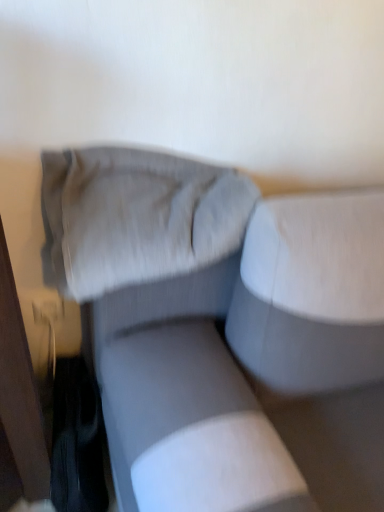
Locate an element on the screen. This screenshot has height=512, width=384. textured gray couch at center is located at coordinates (203, 316).

Describe the element at coordinates (203, 316) in the screenshot. This screenshot has width=384, height=512. I see `textured gray couch at center` at that location.

Describe the element at coordinates (136, 217) in the screenshot. I see `suede-like gray pillow at upper center` at that location.

Image resolution: width=384 pixels, height=512 pixels. Find the location of `suede-like gray pillow at upper center`. suede-like gray pillow at upper center is located at coordinates (136, 217).

In order to face suede-like gray pillow at upper center, should I rotate leftwards or rightwards?

Turn left by 5.592 degrees to look at suede-like gray pillow at upper center.

This screenshot has width=384, height=512. In order to click on textured gray couch at center in this screenshot , I will do `click(203, 316)`.

Based on their positions, is textured gray couch at center located to the left or right of suede-like gray pillow at upper center?

textured gray couch at center is to the right of suede-like gray pillow at upper center.

Is textured gray couch at center in front of or behind suede-like gray pillow at upper center in the image?

textured gray couch at center is positioned closer to the viewer than suede-like gray pillow at upper center.

Which is behind, point (142, 273) or point (75, 238)?

The point (75, 238) is more distant.

From the image's perspective, is textured gray couch at center above or below suede-like gray pillow at upper center?

Based on their image positions, textured gray couch at center is located beneath suede-like gray pillow at upper center.

From a real-world perspective, is textured gray couch at center beneath suede-like gray pillow at upper center?

Yes.

Which of these two, textured gray couch at center or suede-like gray pillow at upper center, is wider?

textured gray couch at center is wider.

Who is taller, textured gray couch at center or suede-like gray pillow at upper center?

textured gray couch at center.

Between textured gray couch at center and suede-like gray pillow at upper center, which one has larger size?

textured gray couch at center is bigger.

Would you say textured gray couch at center is inside or outside suede-like gray pillow at upper center?

textured gray couch at center is outside suede-like gray pillow at upper center.

Is textured gray couch at center with suede-like gray pillow at upper center?

Yes, textured gray couch at center is in contact with suede-like gray pillow at upper center.

Is textured gray couch at center oriented towards suede-like gray pillow at upper center?

No, textured gray couch at center does not turn towards suede-like gray pillow at upper center.

Locate an element on the screen. This screenshot has height=512, width=384. pillow located on the left of textured gray couch at center is located at coordinates (136, 217).

Looking at this image, considering the relative positions of suede-like gray pillow at upper center and textured gray couch at center in the image provided, is suede-like gray pillow at upper center to the left of textured gray couch at center from the viewer's perspective?

Yes.

Relative to textured gray couch at center, is suede-like gray pillow at upper center in front or behind?

suede-like gray pillow at upper center is behind textured gray couch at center.

Is point (132, 273) farther from camera compared to point (65, 170)?

No.

From the image's perspective, is suede-like gray pillow at upper center beneath textured gray couch at center?

No.

From a real-world perspective, relative to textured gray couch at center, is suede-like gray pillow at upper center vertically above or below?

In terms of real-world spatial position, suede-like gray pillow at upper center is above textured gray couch at center.

From the picture: Which object is wider, suede-like gray pillow at upper center or textured gray couch at center?

textured gray couch at center.

Does suede-like gray pillow at upper center have a greater height compared to textured gray couch at center?

Incorrect, the height of suede-like gray pillow at upper center is not larger of that of textured gray couch at center.

Between suede-like gray pillow at upper center and textured gray couch at center, which one has smaller size?

With smaller size is suede-like gray pillow at upper center.

Could textured gray couch at center be considered to be inside suede-like gray pillow at upper center?

Actually, textured gray couch at center is outside suede-like gray pillow at upper center.

Looking at this image, is there a large distance between suede-like gray pillow at upper center and textured gray couch at center?

No, suede-like gray pillow at upper center is not far from textured gray couch at center.

Is suede-like gray pillow at upper center looking in the opposite direction of textured gray couch at center?

Yes, suede-like gray pillow at upper center's orientation is away from textured gray couch at center.

Identify the location of studio couch below the suede-like gray pillow at upper center (from the image's perspective). The height and width of the screenshot is (512, 384). (203, 316).

At what (x,y) coordinates should I click in order to perform the action: click on studio couch in front of the suede-like gray pillow at upper center. Please return your answer as a coordinate pair (x, y). Looking at the image, I should click on (203, 316).

Locate an element on the screen. studio couch located on the right of suede-like gray pillow at upper center is located at coordinates (203, 316).